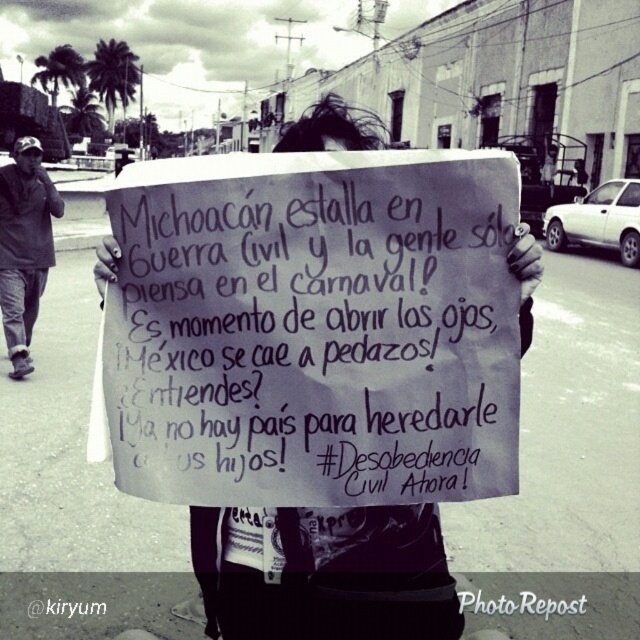
Does point (401, 180) come in front of point (38, 228)?

Yes.

Looking at this image, is handwritten paper sign at center positioned at the back of dark gray jacket at left?

No, it is in front of dark gray jacket at left.

This screenshot has height=640, width=640. I want to click on handwritten paper sign at center, so click(314, 339).

At what (x,y) coordinates should I click in order to perform the action: click on handwritten paper sign at center. Please return your answer as a coordinate pair (x, y). This screenshot has width=640, height=640. Looking at the image, I should click on (314, 339).